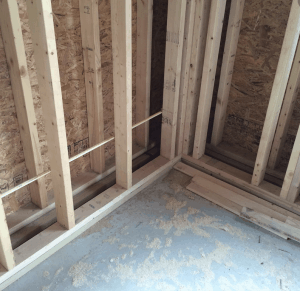
In order to click on corner in this screenshot , I will do `click(179, 59)`.